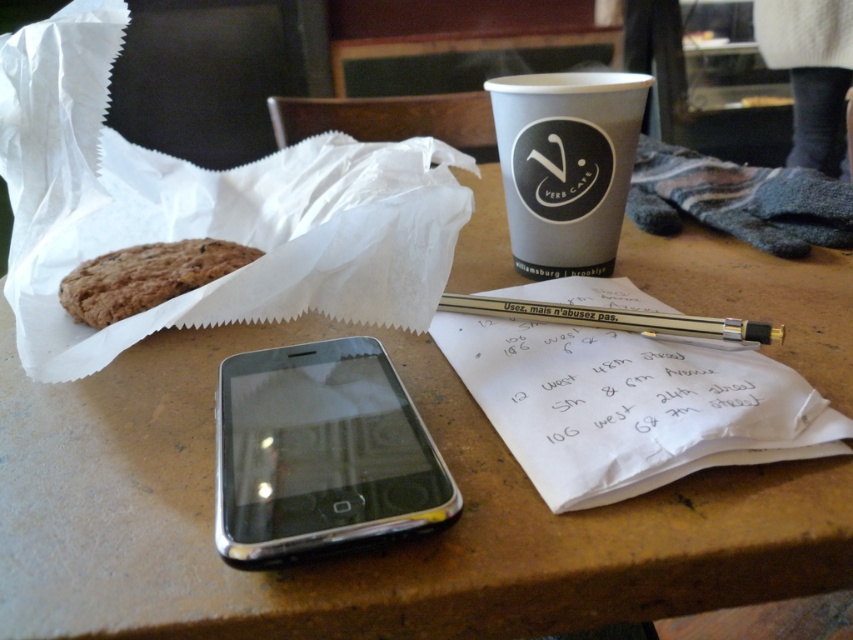
Question: Which object is closer to the camera taking this photo?

Choices:
 (A) white paper with handwritten notes at center
 (B) silver metallic smartphone at center

Answer: (B)

Question: Can you confirm if gray paper cup at upper center is positioned above gold metallic pen at center?

Choices:
 (A) no
 (B) yes

Answer: (B)

Question: Which of the following is the farthest from the observer?

Choices:
 (A) (585, 358)
 (B) (134, 305)

Answer: (B)

Question: Can you confirm if silver metallic smartphone at center is wider than white paper with handwritten notes at center?

Choices:
 (A) no
 (B) yes

Answer: (A)

Question: Considering the real-world distances, which object is farthest from the brown crumbly cookie at upper left?

Choices:
 (A) gold metallic pen at center
 (B) white paper with handwritten notes at center

Answer: (B)

Question: Is silver metallic smartphone at center positioned in front of white paper with handwritten notes at center?

Choices:
 (A) yes
 (B) no

Answer: (A)